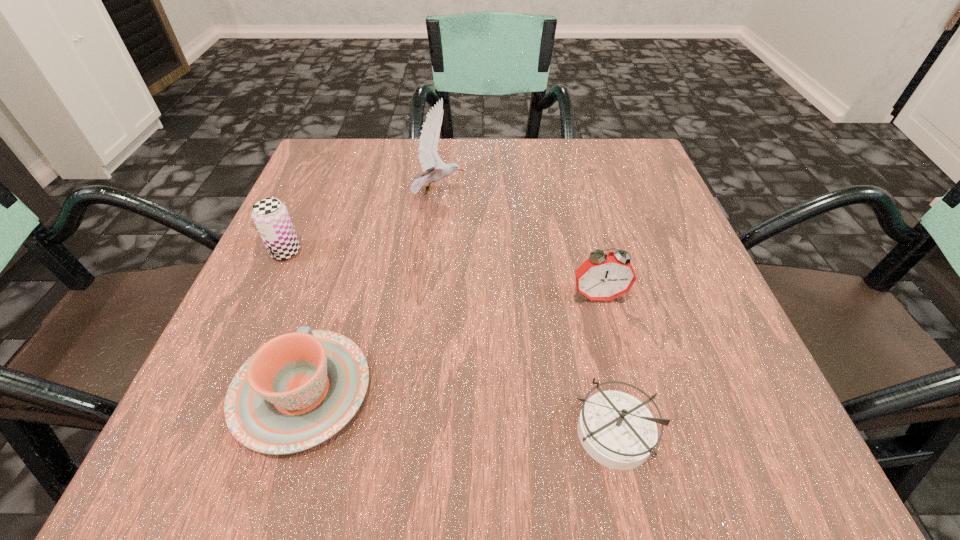
This screenshot has height=540, width=960. I want to click on vacant space that satisfies the following two spatial constraints: 1. at the tip of the beak of the gull; 2. on the front side of the beer can, so click(x=431, y=252).

This screenshot has width=960, height=540. I want to click on blank area in the image that satisfies the following two spatial constraints: 1. at the tip of the beak of the farthest object; 2. on the right side of the compass, so click(410, 433).